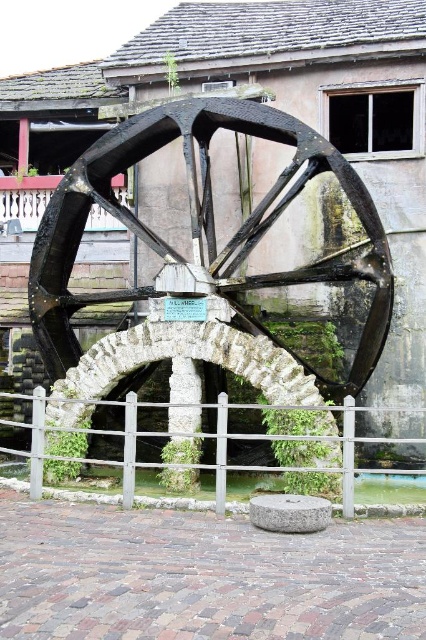
Is point (175, 108) positioned in front of point (236, 496)?

No, (175, 108) is further to viewer.

Who is more distant from viewer, [49,296] or [210,483]?

Positioned behind is point [49,296].

At what (x,y) coordinates should I click in order to perform the action: click on dark brown wooden wagon wheel at center. Please return your answer as a coordinate pair (x, y). Looking at the image, I should click on (204, 227).

The width and height of the screenshot is (426, 640). What are the coordinates of `dark brown wooden wagon wheel at center` in the screenshot? It's located at (204, 227).